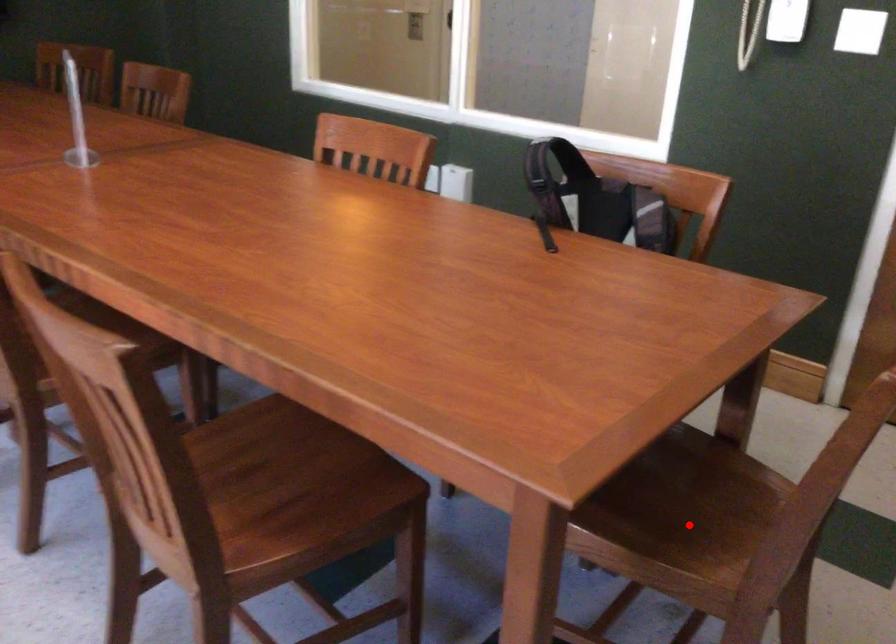
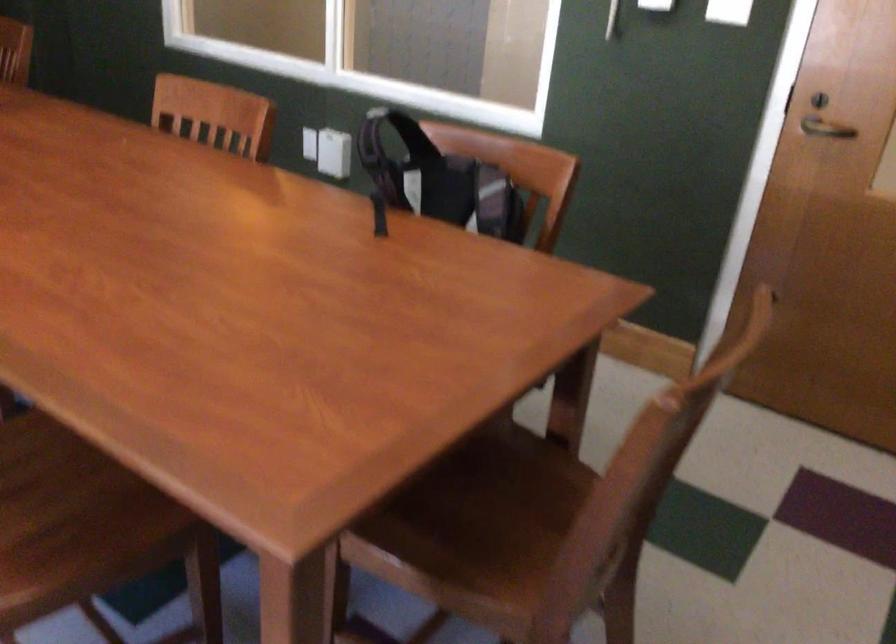
Question: I am providing you with two images of the same scene from different viewpoints. A red point is marked on the first image. At the location where the point appears in image 1, is it still visible in image 2?

Choices:
 (A) Yes
 (B) No

Answer: (A)